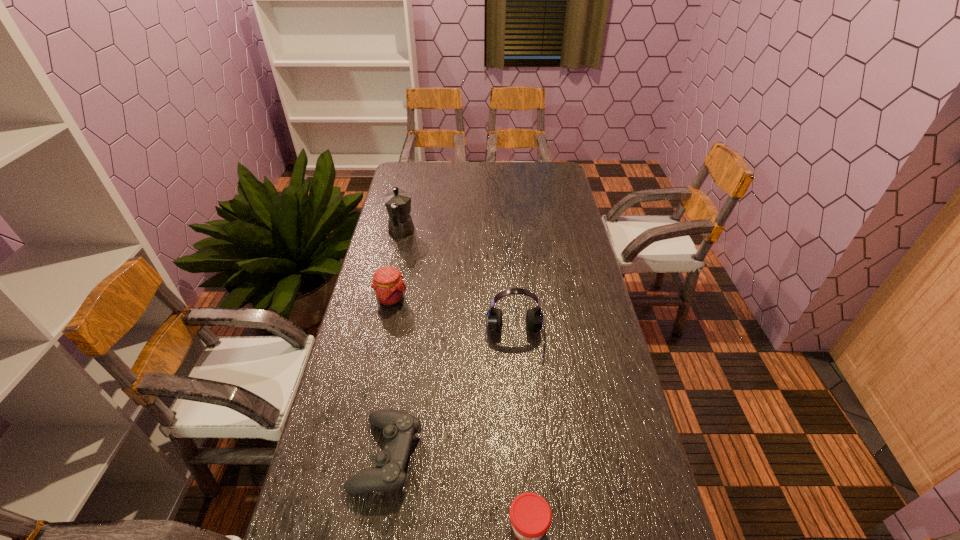
Identify the location of free point located 0.060m on the ear cushions of the fourth shortest object. (518, 380).

This screenshot has height=540, width=960. Find the location of `free spot located on the front of the third shortest object`. free spot located on the front of the third shortest object is located at coordinates (377, 366).

What are the coordinates of `free space located on the right of the control` in the screenshot? It's located at tap(492, 455).

Identify the location of coffeepot that is at the left edge. The image size is (960, 540). (398, 202).

Image resolution: width=960 pixels, height=540 pixels. Identify the location of jam located at the left edge. (389, 288).

The height and width of the screenshot is (540, 960). Find the location of `control that is at the left edge`. control that is at the left edge is located at coordinates tap(399, 428).

Where is `vacant area at the far edge`? This screenshot has width=960, height=540. vacant area at the far edge is located at coordinates (506, 179).

Find the location of a particular element. free region at the left edge of the desktop is located at coordinates (331, 446).

In the image, there is a desktop. Where is `vacant space at the right edge`? This screenshot has height=540, width=960. vacant space at the right edge is located at coordinates (565, 253).

The image size is (960, 540). In the image, there is a desktop. Identify the location of vacant space at the far right corner. click(550, 166).